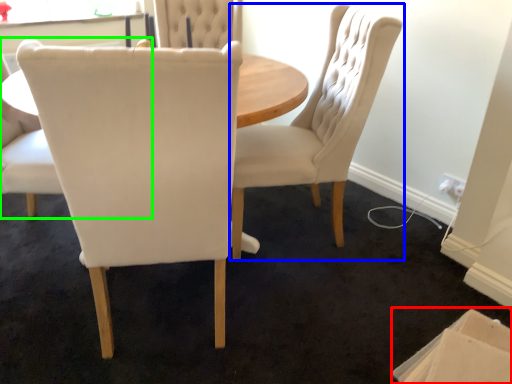
Question: Which object is positioned closest to cardboard box (highlighted by a red box)? Select from chair (highlighted by a blue box) and chair (highlighted by a green box).

Choices:
 (A) chair
 (B) chair

Answer: (A)